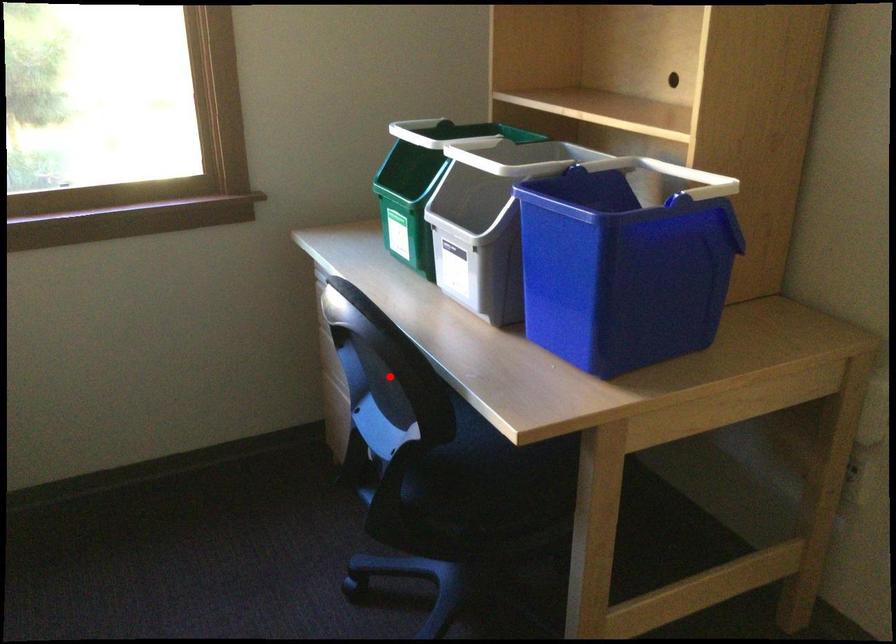
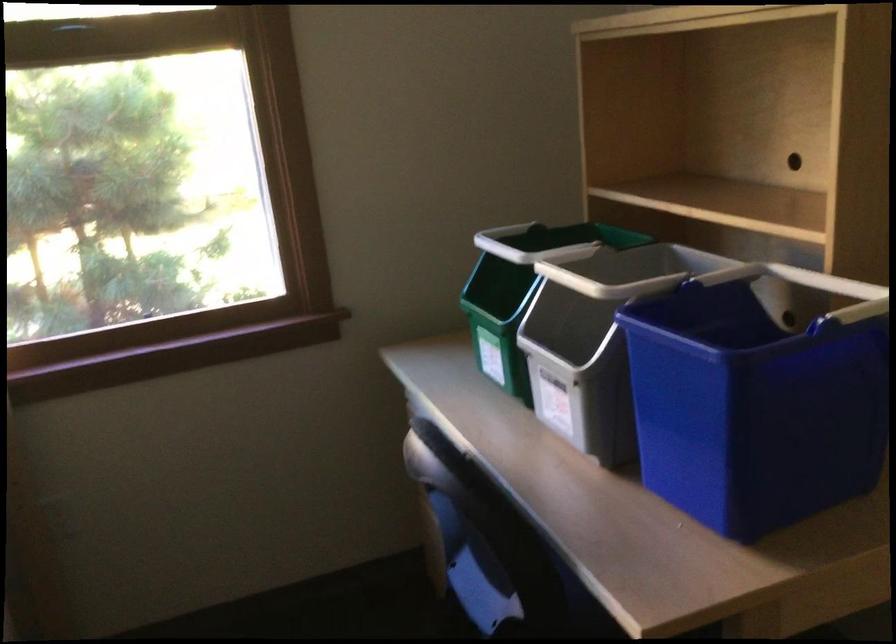
Locate, in the second image, the point that corresponds to the highlighted location in the first image.

(483, 541)